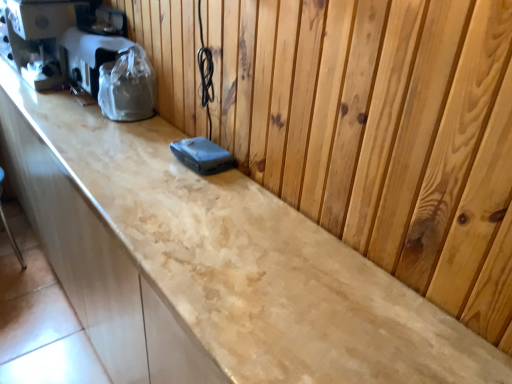
Question: Is matte black coffee machine at left wider or thinner than plastic-wrapped appliance at left?

Choices:
 (A) wide
 (B) thin

Answer: (A)

Question: Is matte black coffee machine at left situated inside plastic-wrapped appliance at left or outside?

Choices:
 (A) outside
 (B) inside

Answer: (A)

Question: In the image, is matte black coffee machine at left positioned in front of or behind plastic-wrapped appliance at left?

Choices:
 (A) behind
 (B) front

Answer: (A)

Question: Is plastic-wrapped appliance at left situated inside matte black coffee machine at left or outside?

Choices:
 (A) outside
 (B) inside

Answer: (A)

Question: Relative to matte black coffee machine at left, is plastic-wrapped appliance at left in front or behind?

Choices:
 (A) front
 (B) behind

Answer: (A)

Question: From the image's perspective, is plastic-wrapped appliance at left above or below matte black coffee machine at left?

Choices:
 (A) above
 (B) below

Answer: (B)

Question: Considering the positions of plastic-wrapped appliance at left and matte black coffee machine at left in the image, is plastic-wrapped appliance at left wider or thinner than matte black coffee machine at left?

Choices:
 (A) wide
 (B) thin

Answer: (B)